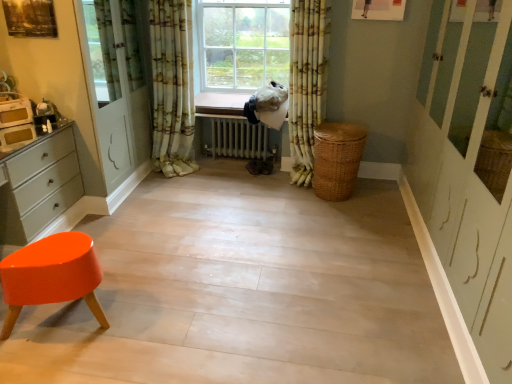
Question: Considering the relative sizes of white metallic radiator at center and floral fabric curtain at center, placed as the second curtain when sorted from right to left, in the image provided, is white metallic radiator at center shorter than floral fabric curtain at center, placed as the second curtain when sorted from right to left,?

Choices:
 (A) yes
 (B) no

Answer: (A)

Question: Considering the relative positions of white metallic radiator at center and floral fabric curtain at center, placed as the second curtain when sorted from right to left, in the image provided, is white metallic radiator at center to the right of floral fabric curtain at center, placed as the second curtain when sorted from right to left, from the viewer's perspective?

Choices:
 (A) no
 (B) yes

Answer: (B)

Question: Does white metallic radiator at center come in front of floral fabric curtain at center, placed as the second curtain when sorted from right to left?

Choices:
 (A) yes
 (B) no

Answer: (B)

Question: From a real-world perspective, is white metallic radiator at center below floral fabric curtain at center, placed as the second curtain when sorted from right to left?

Choices:
 (A) yes
 (B) no

Answer: (A)

Question: Is floral fabric curtain at center, placed as the second curtain when sorted from right to left, a part of white metallic radiator at center?

Choices:
 (A) no
 (B) yes

Answer: (A)

Question: From a real-world perspective, is matte white chest of drawers at left positioned above or below white metallic radiator at center?

Choices:
 (A) above
 (B) below

Answer: (A)

Question: Is matte white chest of drawers at left in front of or behind white metallic radiator at center in the image?

Choices:
 (A) behind
 (B) front

Answer: (B)

Question: Looking at the image, does matte white chest of drawers at left seem bigger or smaller compared to white metallic radiator at center?

Choices:
 (A) big
 (B) small

Answer: (A)

Question: Is point [53, 201] closer or farther from the camera than point [220, 137]?

Choices:
 (A) farther
 (B) closer

Answer: (B)

Question: Is floral fabric curtain at center, which is the second curtain in left-to-right order, inside or outside of floral fabric curtain at center, placed as the second curtain when sorted from right to left?

Choices:
 (A) inside
 (B) outside

Answer: (B)

Question: Is point (307, 1) closer or farther from the camera than point (178, 81)?

Choices:
 (A) farther
 (B) closer

Answer: (B)

Question: Looking at the image, does floral fabric curtain at center, placed as the 1th curtain when sorted from right to left, seem bigger or smaller compared to floral fabric curtain at center, arranged as the 1th curtain when viewed from the left?

Choices:
 (A) small
 (B) big

Answer: (A)

Question: Looking at their shapes, would you say floral fabric curtain at center, which is the second curtain in left-to-right order, is wider or thinner than floral fabric curtain at center, placed as the second curtain when sorted from right to left?

Choices:
 (A) thin
 (B) wide

Answer: (B)

Question: Looking at the image, does woven brown basket at lower right seem bigger or smaller compared to white metallic radiator at center?

Choices:
 (A) big
 (B) small

Answer: (A)

Question: In terms of height, does woven brown basket at lower right look taller or shorter compared to white metallic radiator at center?

Choices:
 (A) tall
 (B) short

Answer: (A)